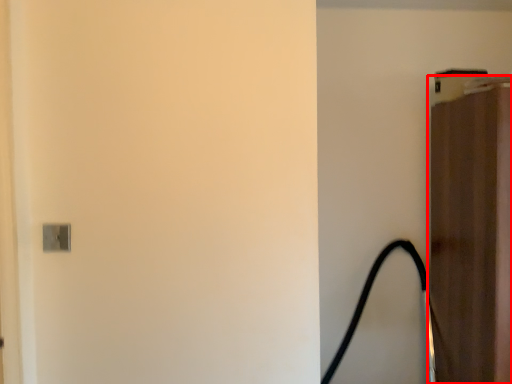
Question: Considering the relative positions of door (annotated by the red box) and garden hose in the image provided, where is door (annotated by the red box) located with respect to the staircase?

Choices:
 (A) right
 (B) left

Answer: (A)